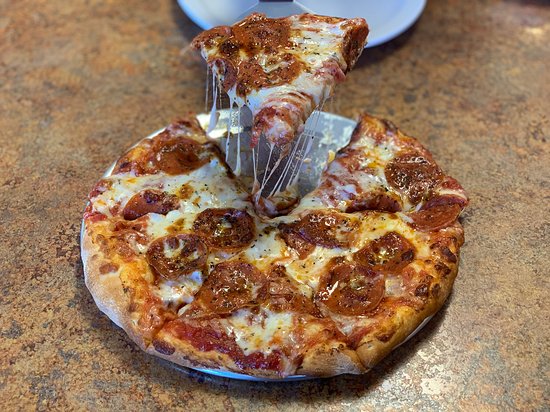
Image resolution: width=550 pixels, height=412 pixels. I want to click on metal utensil, so click(x=275, y=9).